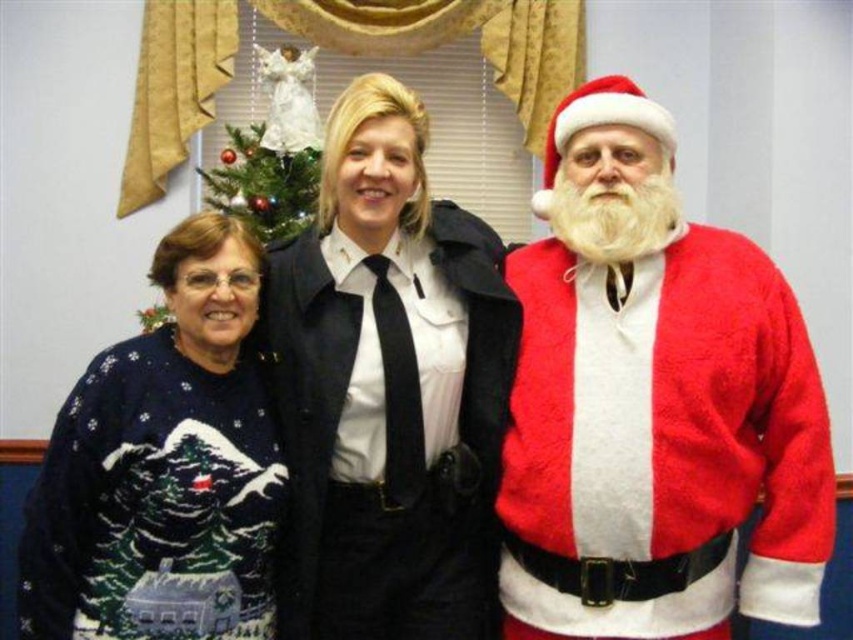
Question: Which point is closer to the camera?

Choices:
 (A) navy sweater at left
 (B) matte black uniform at center

Answer: (A)

Question: Among these points, which one is farthest from the camera?

Choices:
 (A) (404, 392)
 (B) (283, 220)

Answer: (B)

Question: Does fuzzy red santa at right appear on the left side of navy sweater at left?

Choices:
 (A) no
 (B) yes

Answer: (A)

Question: Which object is positioned farthest from the fuzzy red santa at right?

Choices:
 (A) matte black uniform at center
 (B) green matte christmas tree at center
 (C) navy sweater at left

Answer: (B)

Question: Can you confirm if navy sweater at left is positioned above green matte christmas tree at center?

Choices:
 (A) no
 (B) yes

Answer: (A)

Question: Considering the relative positions of matte black uniform at center and green matte christmas tree at center in the image provided, where is matte black uniform at center located with respect to green matte christmas tree at center?

Choices:
 (A) left
 (B) right

Answer: (B)